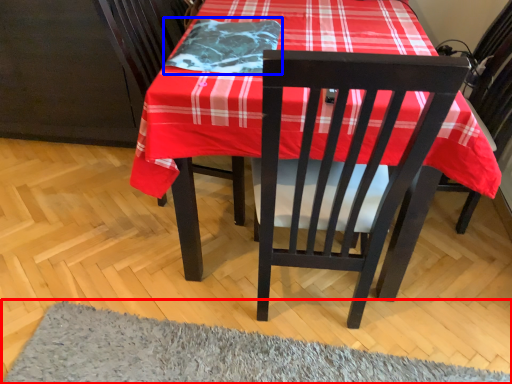
Question: Which object is closer to the camera taking this photo, mat (highlighted by a red box) or blanket (highlighted by a blue box)?

Choices:
 (A) mat
 (B) blanket

Answer: (A)